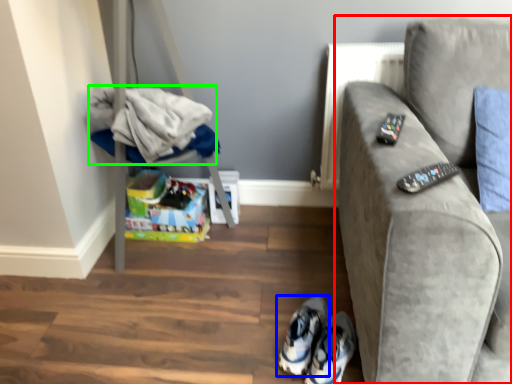
Question: Estimate the real-world distances between objects in this image. Which object is farther from studio couch (highlighted by a red box), footwear (highlighted by a blue box) or laundry (highlighted by a green box)?

Choices:
 (A) footwear
 (B) laundry

Answer: (B)